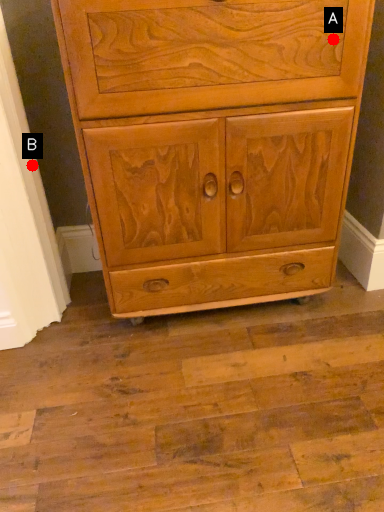
Question: Two points are circled on the image, labeled by A and B beside each circle. Which point is further to the camera?

Choices:
 (A) A is further
 (B) B is further

Answer: (B)